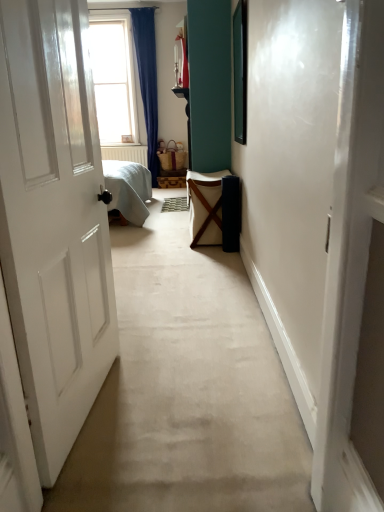
What do you see at coordinates (174, 204) in the screenshot? Image resolution: width=384 pixels, height=512 pixels. I see `textured beige doormat at center` at bounding box center [174, 204].

This screenshot has width=384, height=512. Find the location of `clear glass window at upper left`. clear glass window at upper left is located at coordinates (114, 79).

The width and height of the screenshot is (384, 512). In order to click on textured beige doormat at center in this screenshot , I will do point(174,204).

Is clear glass window at upper left far away from textured beige doormat at center?

clear glass window at upper left is far away from textured beige doormat at center.

Which is nearer, (103, 127) or (186, 202)?

Clearly, point (103, 127) is more distant from the camera than point (186, 202).

From the image's perspective, would you say clear glass window at upper left is positioned over textured beige doormat at center?

Yes, from the image's perspective, clear glass window at upper left is on top of textured beige doormat at center.

Does white canvas laundry basket at center turn towards textured beige doormat at center?

No, white canvas laundry basket at center is not aimed at textured beige doormat at center.

Are white canvas laundry basket at center and textured beige doormat at center making contact?

No.

Does white canvas laundry basket at center have a smaller size compared to textured beige doormat at center?

No, white canvas laundry basket at center is not smaller than textured beige doormat at center.

Identify the location of doormat above the white canvas laundry basket at center (from the image's perspective). (174, 204).

From the image's perspective, would you say clear glass window at upper left is positioned over white canvas laundry basket at center?

Yes, from the image's perspective, clear glass window at upper left is over white canvas laundry basket at center.

Measure the distance from clear glass window at upper left to white canvas laundry basket at center.

The distance of clear glass window at upper left from white canvas laundry basket at center is 9.51 feet.

Based on the photo, are clear glass window at upper left and white canvas laundry basket at center far apart?

clear glass window at upper left is positioned a significant distance from white canvas laundry basket at center.

From a real-world perspective, is clear glass window at upper left physically located above or below white canvas laundry basket at center?

clear glass window at upper left is situated higher than white canvas laundry basket at center in the real world.

From a real-world perspective, between white canvas laundry basket at center and clear glass window at upper left, who is vertically higher?

From a 3D spatial view, clear glass window at upper left is above.

Which is farther, (194,203) or (111,55)?

The point (111,55) is behind.

Is white canvas laundry basket at center inside or outside of clear glass window at upper left?

white canvas laundry basket at center exists outside the volume of clear glass window at upper left.

Is textured beige doormat at center to the left of white canvas laundry basket at center from the viewer's perspective?

Indeed, textured beige doormat at center is positioned on the left side of white canvas laundry basket at center.

From the image's perspective, is textured beige doormat at center over white canvas laundry basket at center?

Correct, textured beige doormat at center appears higher than white canvas laundry basket at center in the image.

Is textured beige doormat at center positioned far away from white canvas laundry basket at center?

Yes, textured beige doormat at center and white canvas laundry basket at center are located far from each other.

Considering the sizes of objects textured beige doormat at center and clear glass window at upper left in the image provided, who is bigger, textured beige doormat at center or clear glass window at upper left?

clear glass window at upper left.

In the scene shown: From a real-world perspective, between textured beige doormat at center and clear glass window at upper left, who is vertically lower?

In real-world perspective, textured beige doormat at center is lower.

Is textured beige doormat at center spatially inside clear glass window at upper left, or outside of it?

textured beige doormat at center cannot be found inside clear glass window at upper left.

This screenshot has height=512, width=384. What are the coordinates of `doormat below the clear glass window at upper left (from the image's perspective)` in the screenshot? It's located at 174,204.

The width and height of the screenshot is (384, 512). There is a textured beige doormat at center. Find the location of `furniture above it (from a real-world perspective)`. furniture above it (from a real-world perspective) is located at coordinates (205, 207).

Looking at the image, which one is located further to white canvas laundry basket at center, textured beige doormat at center or clear glass window at upper left?

clear glass window at upper left.

Based on their spatial positions, is clear glass window at upper left or textured beige doormat at center closer to white canvas laundry basket at center?

textured beige doormat at center.

Estimate the real-world distances between objects in this image. Which object is further from clear glass window at upper left, textured beige doormat at center or white canvas laundry basket at center?

white canvas laundry basket at center.

Considering their positions, is white canvas laundry basket at center positioned further to textured beige doormat at center than clear glass window at upper left?

Among the two, clear glass window at upper left is located further to textured beige doormat at center.

Which object lies further to the anchor point textured beige doormat at center, clear glass window at upper left or white canvas laundry basket at center?

Based on the image, clear glass window at upper left appears to be further to textured beige doormat at center.

Based on their spatial positions, is white canvas laundry basket at center or textured beige doormat at center closer to clear glass window at upper left?

Among the two, textured beige doormat at center is located nearer to clear glass window at upper left.

Where is `doormat positioned between white canvas laundry basket at center and clear glass window at upper left from near to far`? This screenshot has height=512, width=384. doormat positioned between white canvas laundry basket at center and clear glass window at upper left from near to far is located at coordinates (174, 204).